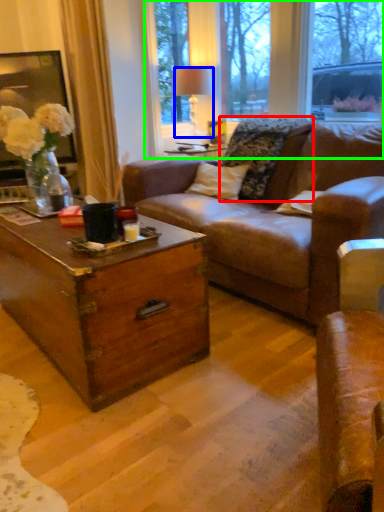
Question: Which object is positioned closest to pillow (highlighted by a red box)? Select from lamp (highlighted by a blue box) and bay window (highlighted by a green box).

Choices:
 (A) lamp
 (B) bay window

Answer: (A)